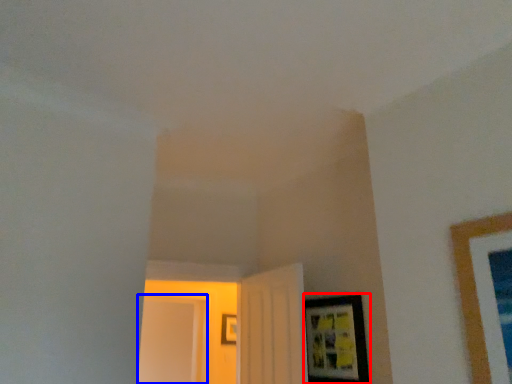
Question: Among these objects, which one is nearest to the camera, picture frame (highlighted by a red box) or glass door (highlighted by a blue box)?

Choices:
 (A) picture frame
 (B) glass door

Answer: (A)